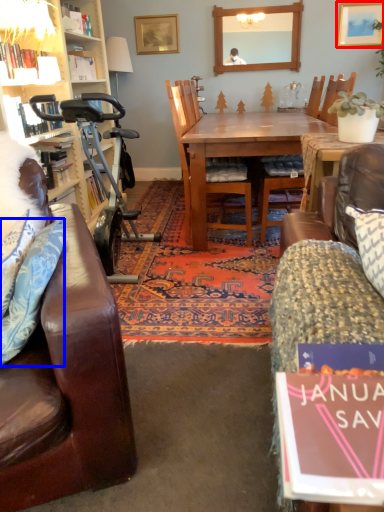
Question: Which object appears closest to the camera in this image, picture frame (highlighted by a red box) or pillow (highlighted by a blue box)?

Choices:
 (A) picture frame
 (B) pillow

Answer: (B)